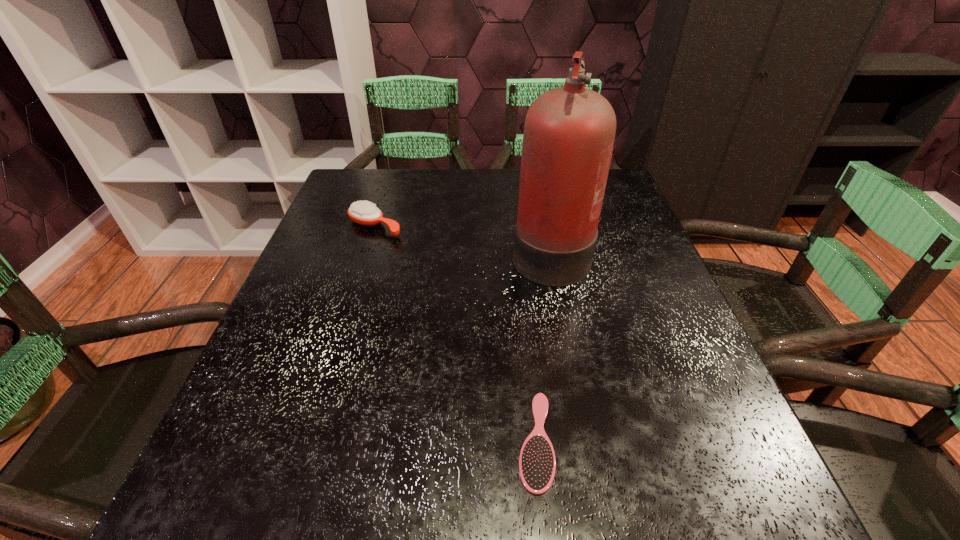
At what (x,y) coordinates should I click in order to perform the action: click on object at the far edge. Please return your answer as a coordinate pair (x, y). The width and height of the screenshot is (960, 540). Looking at the image, I should click on (364, 213).

Where is `object that is at the near edge`? The height and width of the screenshot is (540, 960). object that is at the near edge is located at coordinates (537, 464).

Where is `object present at the left edge`? The width and height of the screenshot is (960, 540). object present at the left edge is located at coordinates (364, 213).

Image resolution: width=960 pixels, height=540 pixels. I want to click on object that is at the right edge, so click(569, 132).

Find the location of a particular element. The image size is (960, 540). object that is at the far left corner is located at coordinates (364, 213).

In the image, there is a desktop. Where is `free space at the far edge`? The width and height of the screenshot is (960, 540). free space at the far edge is located at coordinates (444, 176).

Identify the location of free space at the near edge of the desktop. click(x=490, y=493).

Locate an element on the screen. The image size is (960, 540). free space at the left edge is located at coordinates (331, 296).

In the image, there is a desktop. At what (x,y) coordinates should I click in order to perform the action: click on vacant space at the right edge. Please return your answer as a coordinate pair (x, y). Looking at the image, I should click on coord(719,390).

In order to click on vacant space at the far left corner in this screenshot , I will do `click(387, 172)`.